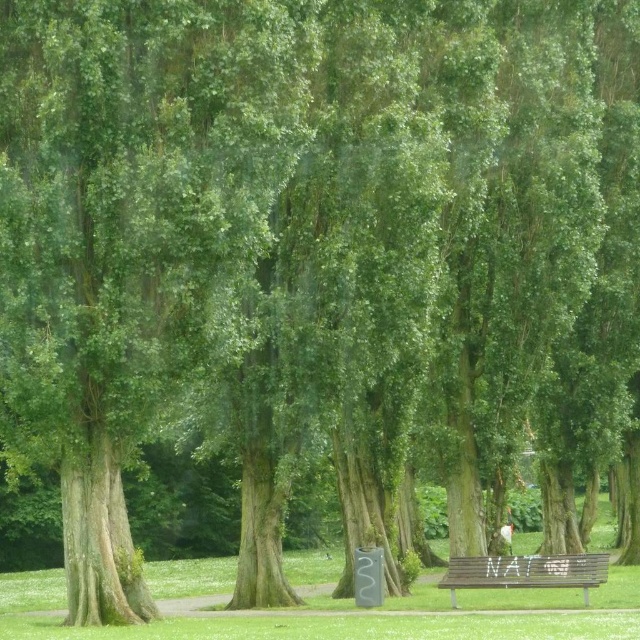
Is green grass at lower center thinner than wooden bench at lower center?

No, green grass at lower center is not thinner than wooden bench at lower center.

Can you confirm if green grass at lower center is positioned above wooden bench at lower center?

Incorrect, green grass at lower center is not positioned above wooden bench at lower center.

Is point (499, 589) positioned in front of point (522, 566)?

No, (499, 589) is behind (522, 566).

Find the location of a particular element. The image size is (640, 640). green grass at lower center is located at coordinates click(310, 618).